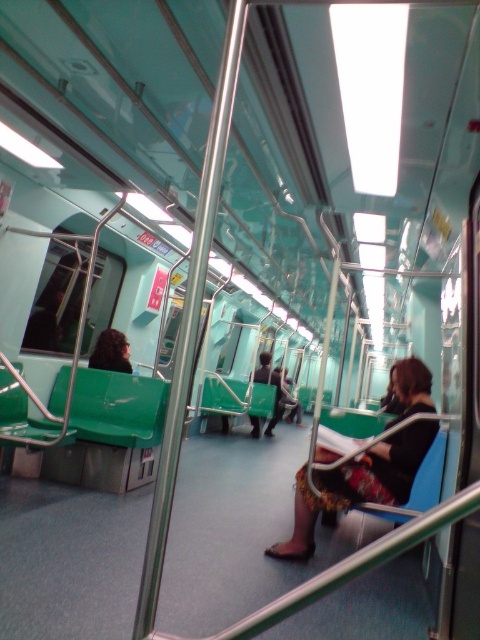
You are a passenger on the subway and you see a black fabric skirt at center and curly brown hair at left. Which object is taller?

The black fabric skirt at center is taller than the curly brown hair at left.

You are a passenger on the subway and notice two items in the scene. One is a black fabric skirt at center and the other is curly brown hair at left. Which item is positioned lower in the image?

The black fabric skirt at center is located below curly brown hair at left, so it is positioned lower in the image.